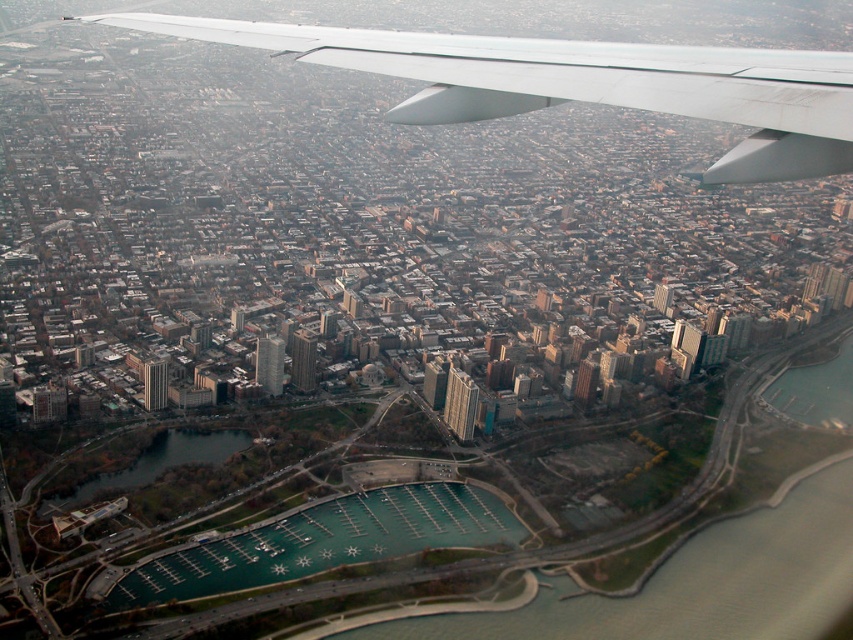
Question: Is white matte wing at upper center positioned at the back of green water at lower center?

Choices:
 (A) no
 (B) yes

Answer: (A)

Question: Which is nearer to the green water at lower center?

Choices:
 (A) white matte wing at upper center
 (B) green water at lower left

Answer: (B)

Question: Which object appears farthest from the camera in this image?

Choices:
 (A) green water at lower center
 (B) white matte wing at upper center

Answer: (A)

Question: Does white matte wing at upper center have a larger size compared to green water at lower center?

Choices:
 (A) yes
 (B) no

Answer: (A)

Question: Can you confirm if white matte wing at upper center is positioned to the left of green water at lower left?

Choices:
 (A) yes
 (B) no

Answer: (B)

Question: Which point is farther to the camera?

Choices:
 (A) green water at lower center
 (B) green water at lower left
 (C) white matte wing at upper center

Answer: (B)